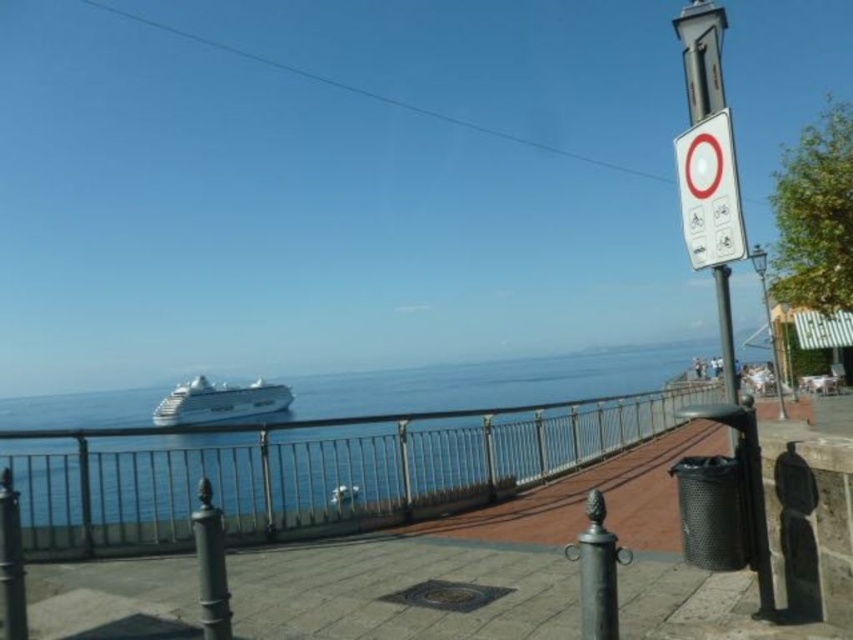
Question: Considering the relative positions of white plastic sign at upper right and white glossy cruise ship at center in the image provided, where is white plastic sign at upper right located with respect to white glossy cruise ship at center?

Choices:
 (A) above
 (B) below

Answer: (A)

Question: Does white plastic sign at upper right have a greater width compared to white glossy cruise ship at center?

Choices:
 (A) yes
 (B) no

Answer: (A)

Question: Which point is farther from the camera taking this photo?

Choices:
 (A) (683, 170)
 (B) (438, 483)

Answer: (B)

Question: Which of the following is the farthest from the observer?

Choices:
 (A) (262, 397)
 (B) (242, 424)

Answer: (A)

Question: Which object appears closest to the camera in this image?

Choices:
 (A) blue water at center
 (B) white plastic sign at upper right
 (C) white glossy cruise ship at center

Answer: (A)

Question: Is white plastic sign at upper right to the left of white glossy cruise ship at center from the viewer's perspective?

Choices:
 (A) yes
 (B) no

Answer: (B)